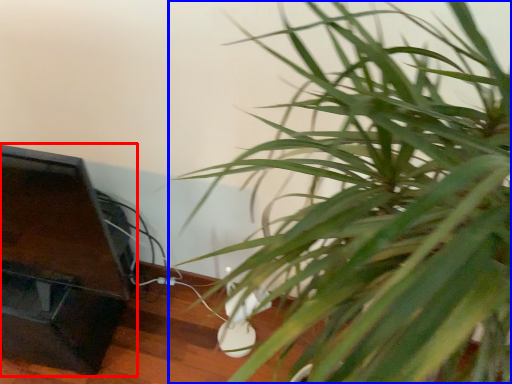
Question: Which point is closer to the camera, furniture (highlighted by a red box) or houseplant (highlighted by a blue box)?

Choices:
 (A) furniture
 (B) houseplant

Answer: (B)